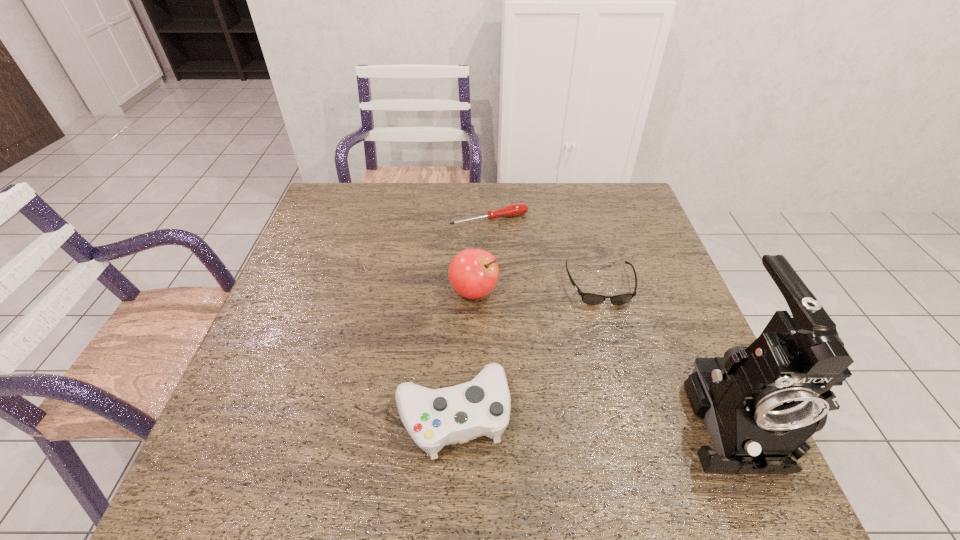
Where is `sunglasses at the right edge`? The image size is (960, 540). sunglasses at the right edge is located at coordinates (589, 298).

The height and width of the screenshot is (540, 960). Find the location of `object that is at the near right corner`. object that is at the near right corner is located at coordinates (761, 403).

This screenshot has width=960, height=540. In order to click on vacant space at the far edge of the desktop in this screenshot , I will do `click(433, 201)`.

In the image, there is a desktop. Where is `free region at the near edge`? free region at the near edge is located at coordinates (617, 423).

The width and height of the screenshot is (960, 540). In the image, there is a desktop. In order to click on vacant space at the left edge in this screenshot , I will do coord(324,239).

The image size is (960, 540). Find the location of `free spot at the right edge of the desktop`. free spot at the right edge of the desktop is located at coordinates 620,271.

Identify the location of free space at the far left corner. (329, 211).

In order to click on free spot at the near left corner of the desktop in this screenshot , I will do `click(241, 403)`.

Identify the location of vacant space at the far right corner of the desktop. The height and width of the screenshot is (540, 960). (588, 189).

I want to click on empty space between the sunglasses and the third tallest object, so [526, 350].